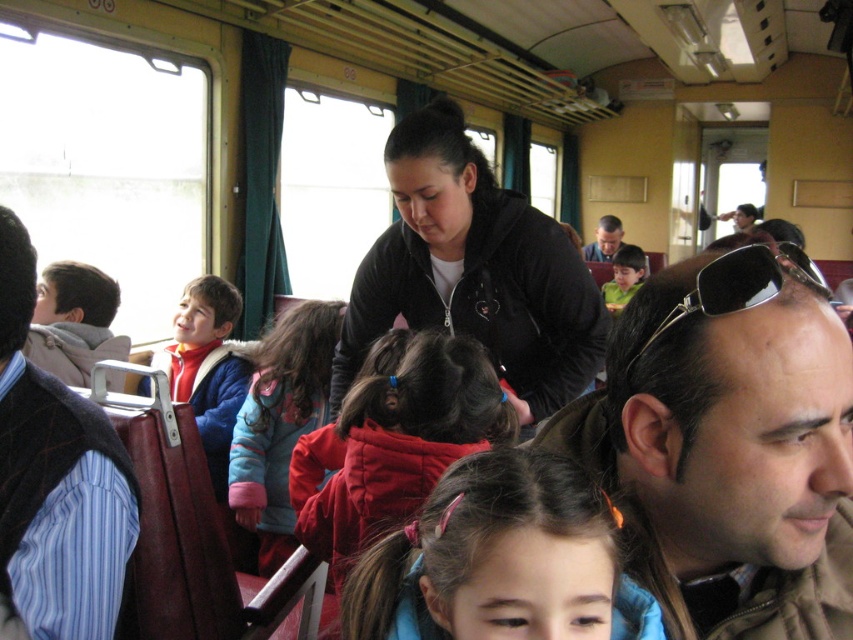
You are a photographer trying to capture a candid shot of the dark brown hair at center and the metallic reflective sunglasses at upper right in the train carriage scene. Given that your camera has a maximum focus range of 8 inches, will both subjects be within the focus range?

The dark brown hair at center and metallic reflective sunglasses at upper right are 7.93 inches apart, so yes, both subjects will be within the camera focus range of 8 inches.